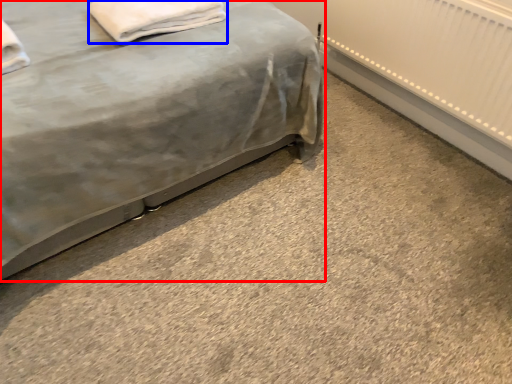
Question: Which object appears farthest to the camera in this image, bed (highlighted by a red box) or material (highlighted by a blue box)?

Choices:
 (A) bed
 (B) material

Answer: (B)